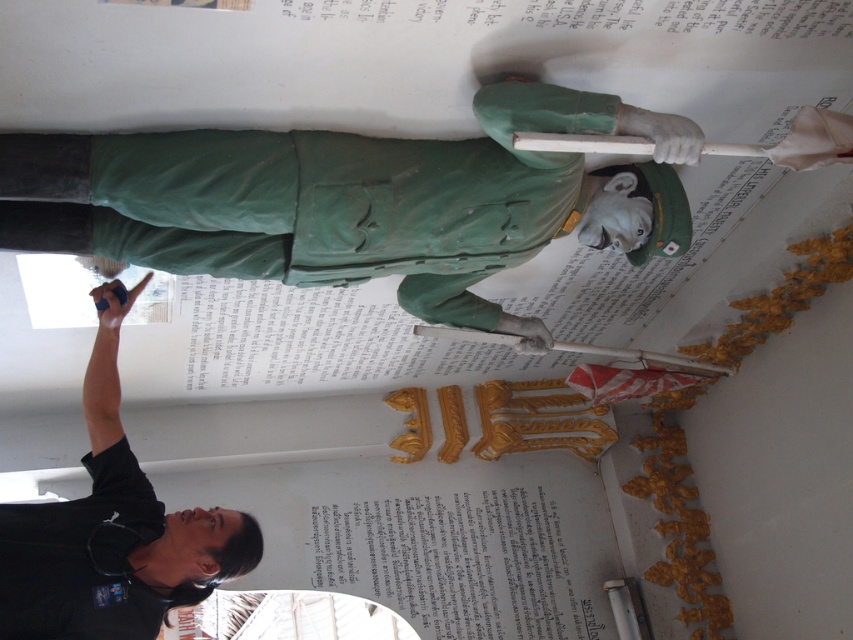
In the scene shown: Who is lower down, matte green statue at upper center or black matte shirt at lower left?

Positioned lower is black matte shirt at lower left.

Is matte green statue at upper center in front of black matte shirt at lower left?

Yes, it is in front of black matte shirt at lower left.

In order to click on matte green statue at upper center in this screenshot , I will do `click(346, 200)`.